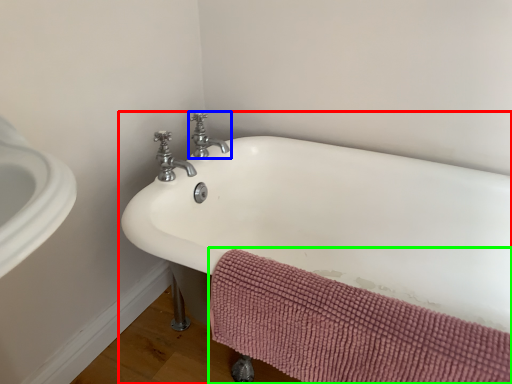
Question: Considering the real-world distances, which object is closest to bathtub (highlighted by a red box)? tap (highlighted by a blue box) or bath towel (highlighted by a green box).

Choices:
 (A) tap
 (B) bath towel

Answer: (B)